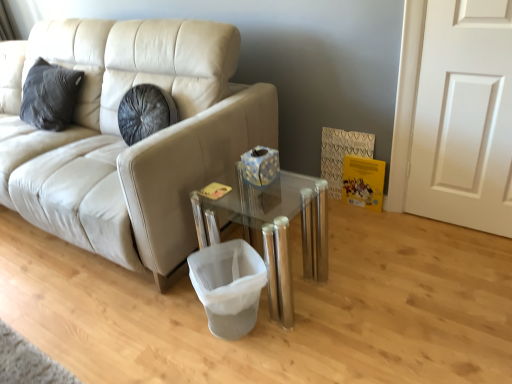
Question: Is point (148, 155) positioned closer to the camera than point (487, 31)?

Choices:
 (A) farther
 (B) closer

Answer: (B)

Question: From a real-world perspective, is beige leather couch at left above or below white matte door at right?

Choices:
 (A) below
 (B) above

Answer: (A)

Question: Which object is the farthest from the white fabric laundry basket at lower center?

Choices:
 (A) white matte door at right
 (B) transparent glass table at center
 (C) beige leather couch at left

Answer: (A)

Question: Which object is the farthest from the white fabric laundry basket at lower center?

Choices:
 (A) transparent glass table at center
 (B) beige leather couch at left
 (C) white matte door at right

Answer: (C)